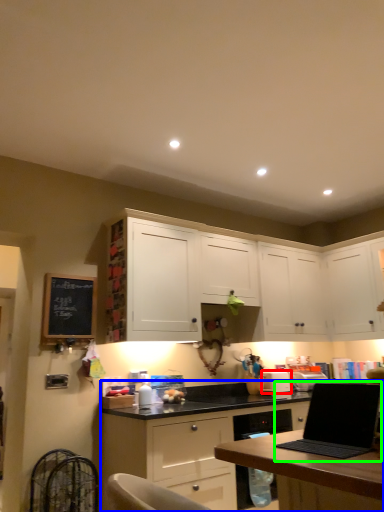
Question: Which is nearer to the appliance (highlighted by a red box)? cabinetry (highlighted by a blue box) or laptop (highlighted by a green box).

Choices:
 (A) cabinetry
 (B) laptop

Answer: (A)